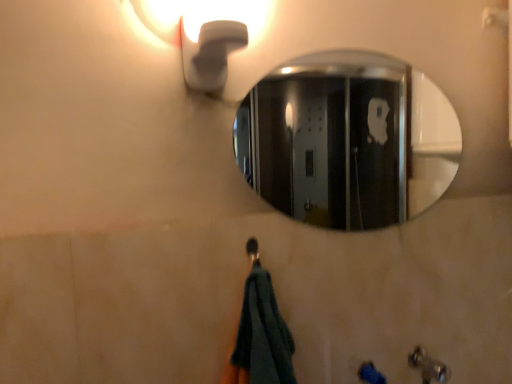
Question: Relative to metallic silver faucet at lower right, is white matte light fixture at upper left in front or behind?

Choices:
 (A) behind
 (B) front

Answer: (B)

Question: Does point (260, 14) appear closer or farther from the camera than point (367, 362)?

Choices:
 (A) closer
 (B) farther

Answer: (A)

Question: Which object is positioned farthest from the polished chrome mirror at upper center?

Choices:
 (A) white matte light fixture at upper left
 (B) metallic silver faucet at lower right

Answer: (B)

Question: Based on their relative distances, which object is nearer to the metallic silver faucet at lower right?

Choices:
 (A) white matte light fixture at upper left
 (B) polished chrome mirror at upper center

Answer: (A)